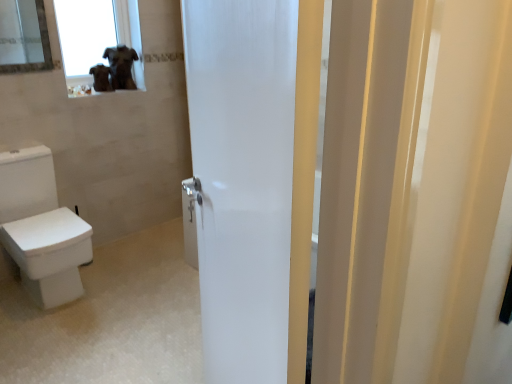
Question: Should I look upward or downward to see transparent glass window at upper left?

Choices:
 (A) down
 (B) up

Answer: (B)